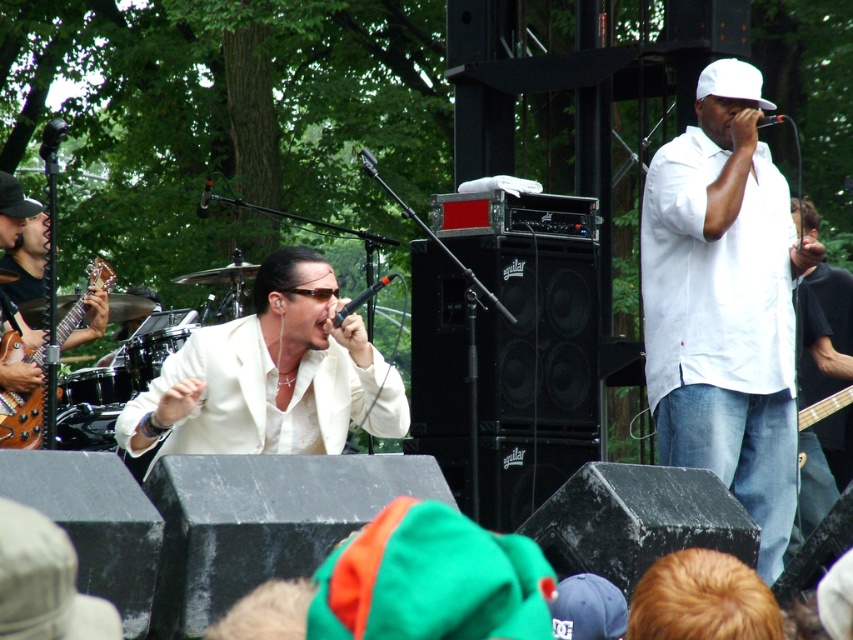
Is white matte shirt at upper right taller than wooden electric guitar at left?

Indeed, white matte shirt at upper right has a greater height compared to wooden electric guitar at left.

From the picture: Which of these two, white matte shirt at upper right or wooden electric guitar at left, stands taller?

Standing taller between the two is white matte shirt at upper right.

Does point (698, 368) come behind point (97, 280)?

No.

Identify the location of white matte shirt at upper right. (724, 304).

Who is higher up, white matte shirt at upper right or white glossy suit at center?

Positioned higher is white matte shirt at upper right.

Identify the location of white matte shirt at upper right. The image size is (853, 640). coord(724,304).

Between point (741, 429) and point (257, 390), which one is positioned behind?

Point (741, 429)

This screenshot has width=853, height=640. Identify the location of white matte shirt at upper right. (724, 304).

Which is more to the left, white glossy suit at center or wooden electric guitar at left?

Positioned to the left is wooden electric guitar at left.

Does white glossy suit at center lie behind wooden electric guitar at left?

No, white glossy suit at center is in front of wooden electric guitar at left.

This screenshot has height=640, width=853. I want to click on white glossy suit at center, so click(x=271, y=374).

At what (x,y) coordinates should I click in order to perform the action: click on white glossy suit at center. Please return your answer as a coordinate pair (x, y). The width and height of the screenshot is (853, 640). Looking at the image, I should click on (271, 374).